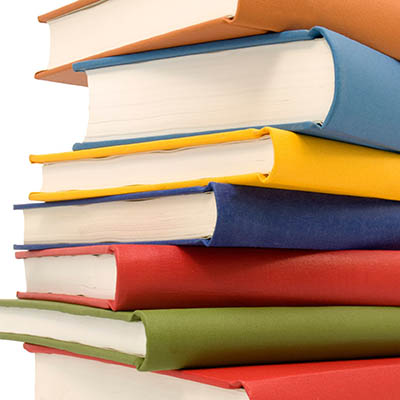
The width and height of the screenshot is (400, 400). Find the location of `stacked hardcover books`. stacked hardcover books is located at coordinates (251, 11), (350, 86), (281, 168), (263, 210), (254, 261), (261, 328), (307, 390).